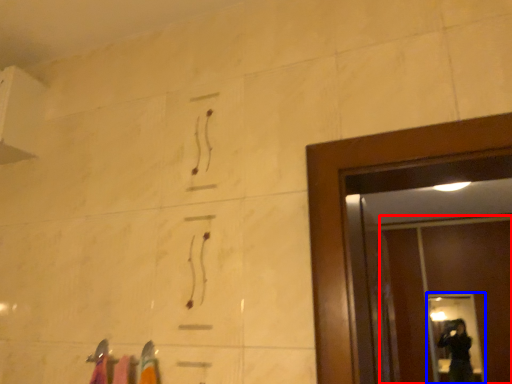
Question: Which of the following is the closest to the observer, screen door (highlighted by a red box) or glass door (highlighted by a blue box)?

Choices:
 (A) screen door
 (B) glass door

Answer: (A)